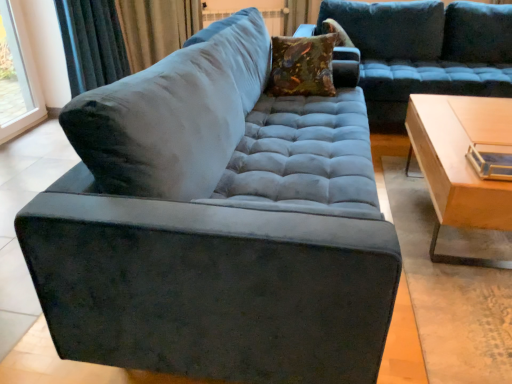
Question: Which direction should I rotate to face velvet-like brown pillow at upper center, which appears as the second pillow when viewed from the front, — up or down?

Choices:
 (A) down
 (B) up

Answer: (B)

Question: Does velvet curtain at upper left have a lesser width compared to velvet blue couch at upper center?

Choices:
 (A) no
 (B) yes

Answer: (B)

Question: Is velvet curtain at upper left smaller than velvet blue couch at upper center?

Choices:
 (A) yes
 (B) no

Answer: (A)

Question: From the image's perspective, would you say velvet curtain at upper left is shown under velvet blue couch at upper center?

Choices:
 (A) no
 (B) yes

Answer: (A)

Question: From a real-world perspective, is velvet curtain at upper left positioned over velvet blue couch at upper center based on gravity?

Choices:
 (A) yes
 (B) no

Answer: (A)

Question: Would you say velvet blue couch at upper center is part of velvet curtain at upper left's contents?

Choices:
 (A) yes
 (B) no

Answer: (B)

Question: Does velvet curtain at upper left lie behind velvet blue couch at upper center?

Choices:
 (A) no
 (B) yes

Answer: (B)

Question: From the image's perspective, is light wood/wooden table at right above velvet-like brown pillow at upper center, acting as the first pillow starting from the right?

Choices:
 (A) yes
 (B) no

Answer: (B)

Question: Is light wood/wooden table at right at the left side of velvet-like brown pillow at upper center, marked as the second pillow in a bottom-to-top arrangement?

Choices:
 (A) yes
 (B) no

Answer: (B)

Question: From a real-world perspective, is light wood/wooden table at right located beneath velvet-like brown pillow at upper center, which appears as the second pillow when viewed from the front?

Choices:
 (A) yes
 (B) no

Answer: (A)

Question: From the image's perspective, would you say light wood/wooden table at right is shown under velvet-like brown pillow at upper center, placed as the 1th pillow when sorted from top to bottom?

Choices:
 (A) no
 (B) yes

Answer: (B)

Question: Is light wood/wooden table at right to the right of velvet-like brown pillow at upper center, marked as the second pillow in a bottom-to-top arrangement, from the viewer's perspective?

Choices:
 (A) no
 (B) yes

Answer: (B)

Question: Considering the relative sizes of light wood/wooden table at right and velvet-like brown pillow at upper center, which appears as the second pillow when viewed from the front, in the image provided, is light wood/wooden table at right thinner than velvet-like brown pillow at upper center, which appears as the second pillow when viewed from the front,?

Choices:
 (A) no
 (B) yes

Answer: (A)

Question: Does light wood/wooden table at right have a larger size compared to velvet floral pillow at center, which is the first pillow in front-to-back order?

Choices:
 (A) yes
 (B) no

Answer: (A)